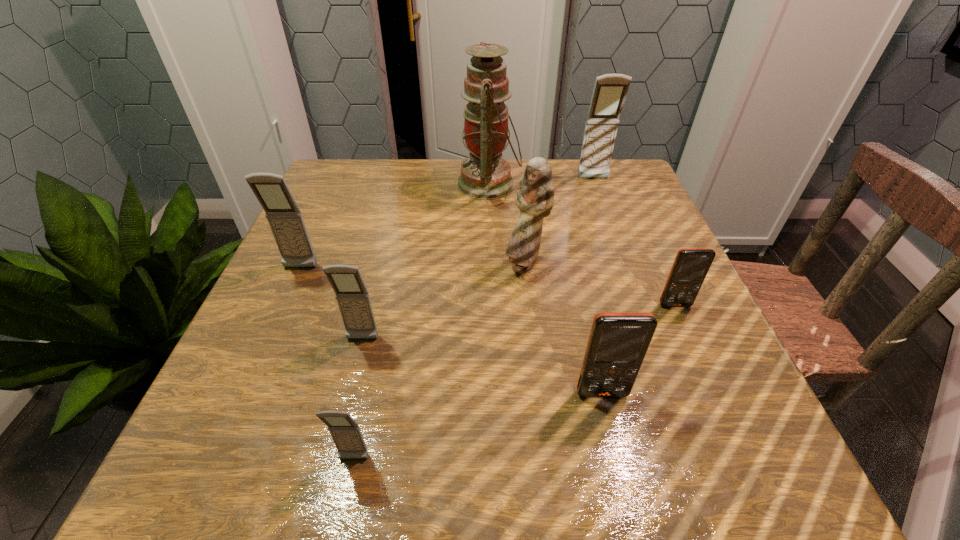
Where is `free space between the oil lamp and the nearest cellular telephone`? free space between the oil lamp and the nearest cellular telephone is located at coordinates (421, 322).

Find the location of a particular element. the fifth closest object to the nearest cellular telephone is located at coordinates (691, 265).

This screenshot has height=540, width=960. I want to click on the sixth closest object to the fifth shortest cellular telephone, so click(x=610, y=90).

This screenshot has height=540, width=960. I want to click on the third closest cellular telephone to the nearest cellular telephone, so click(x=285, y=219).

At what (x,y) coordinates should I click in order to perform the action: click on cellular telephone that can be found as the closest to the oil lamp. Please return your answer as a coordinate pair (x, y). Looking at the image, I should click on (610, 90).

The height and width of the screenshot is (540, 960). I want to click on gray cellular telephone object that ranks as the third closest to the smallest gray cellular telephone, so click(x=610, y=90).

This screenshot has height=540, width=960. I want to click on gray cellular telephone that stands as the third closest to the oil lamp, so click(x=353, y=299).